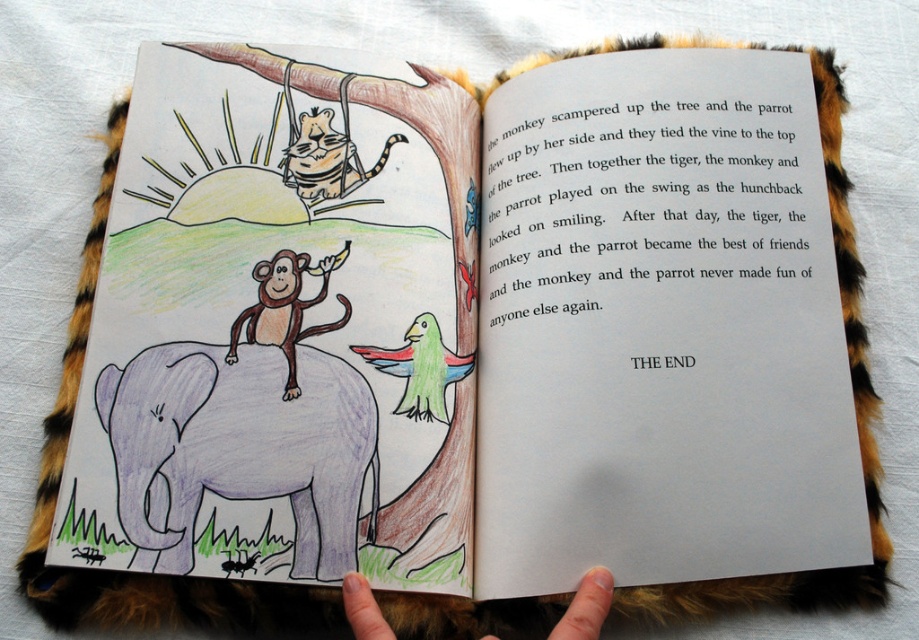
Looking at this image, you are a child trying to decide which object is larger between the purple pastel elephant at lower left and the fur at lower center. Based on the scene described, which one is bigger?

The purple pastel elephant at lower left is bigger than the fur at lower center.

You are an artist trying to draw the scene from the book. You need to place the purple pastel elephant at lower left in your drawing. Where should you position it on a coordinate system where the bottom left corner is 0,0 and the top right corner is 1,1?

The purple pastel elephant at lower left should be positioned at coordinates approximately 0.698 on the x axis and 0.259 on the y axis.

You are a child looking at the open children book. You see the purple pastel elephant at lower left and the smooth brown monkey at center. Which animal is closer to you in the illustration?

The purple pastel elephant at lower left is closer to you because it is in front of the smooth brown monkey at center.